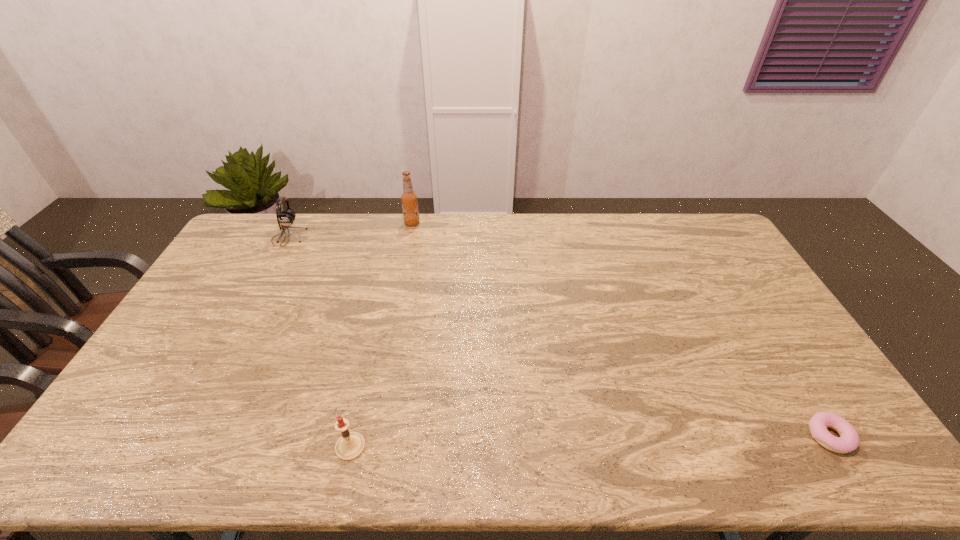
This screenshot has width=960, height=540. Find the location of `unoccupied position between the beer bottle and the third nearest object`. unoccupied position between the beer bottle and the third nearest object is located at coordinates (350, 230).

Locate an element on the screen. This screenshot has width=960, height=540. empty location between the second shortest object and the rightmost object is located at coordinates (589, 441).

I want to click on vacant area that lies between the shortest object and the candle, so click(589, 441).

At what (x,y) coordinates should I click in order to perform the action: click on free space that is in between the second shortest object and the shortest object. Please return your answer as a coordinate pair (x, y). Image resolution: width=960 pixels, height=540 pixels. Looking at the image, I should click on tap(589, 441).

At what (x,y) coordinates should I click in order to perform the action: click on free space between the second shortest object and the third nearest object. Please return your answer as a coordinate pair (x, y). This screenshot has width=960, height=540. Looking at the image, I should click on (320, 342).

The image size is (960, 540). Identify the location of object that is the second closest to the farthest object. (350, 445).

Locate an element on the screen. object that is the second closest to the shortest object is located at coordinates (409, 199).

Identify the location of vacant space that satisfies the following two spatial constraints: 1. on the front label of the tallest object; 2. on the right side of the rightmost object. (370, 436).

Identify the location of free point that satisfies the following two spatial constraints: 1. on the back side of the doughnut; 2. on the left side of the candle. This screenshot has width=960, height=540. (353, 436).

I want to click on blank space that satisfies the following two spatial constraints: 1. on the front label of the beer bottle; 2. on the left side of the doughnut, so click(370, 436).